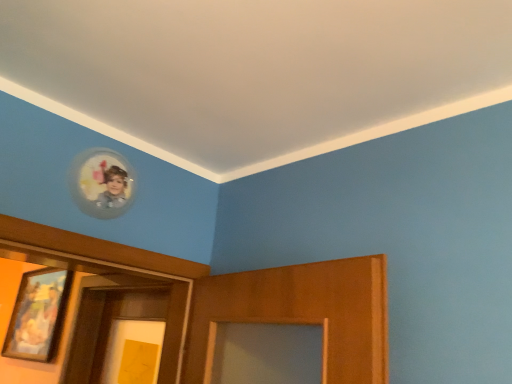
The height and width of the screenshot is (384, 512). What do you see at coordinates (38, 315) in the screenshot?
I see `wooden framed painting at left, positioned as the first picture frame in bottom-to-top order` at bounding box center [38, 315].

Where is `wooden framed painting at left, which is the second picture frame from right to left`? Image resolution: width=512 pixels, height=384 pixels. wooden framed painting at left, which is the second picture frame from right to left is located at coordinates (38, 315).

In order to face wooden framed painting at left, positioned as the first picture frame in bottom-to-top order, should I rotate leftwards or rightwards?

Turn left approximately 26.932 degrees to face it.

What is the approximate height of wooden framed painting at left, positioned as the first picture frame in bottom-to-top order?

The height of wooden framed painting at left, positioned as the first picture frame in bottom-to-top order, is 59.29 centimeters.

This screenshot has width=512, height=384. Describe the element at coordinates (102, 183) in the screenshot. I see `clear glass portrait at upper left, which is the first picture frame in top-to-bottom order` at that location.

Where is `clear glass portrait at upper left, positioned as the first picture frame in front-to-back order`? clear glass portrait at upper left, positioned as the first picture frame in front-to-back order is located at coordinates (102, 183).

Locate an element on the screen. This screenshot has width=512, height=384. wooden framed painting at left, the first picture frame from the left is located at coordinates (38, 315).

Can you confirm if clear glass portrait at upper left, positioned as the first picture frame in front-to-back order, is positioned to the right of wooden framed painting at left, which is counted as the second picture frame, starting from the top?

Correct, you'll find clear glass portrait at upper left, positioned as the first picture frame in front-to-back order, to the right of wooden framed painting at left, which is counted as the second picture frame, starting from the top.

Which is behind, clear glass portrait at upper left, which ranks as the 2th picture frame in back-to-front order, or wooden framed painting at left, which is the second picture frame from right to left?

wooden framed painting at left, which is the second picture frame from right to left, is more distant.

Is point (91, 214) closer or farther from the camera than point (36, 285)?

Clearly, point (91, 214) is closer to the camera than point (36, 285).

From the image's perspective, which is below, clear glass portrait at upper left, which ranks as the 2th picture frame in back-to-front order, or wooden framed painting at left, the first picture frame from the left?

From the image's view, wooden framed painting at left, the first picture frame from the left, is below.

From a real-world perspective, is clear glass portrait at upper left, the 2th picture frame when ordered from left to right, located higher than wooden framed painting at left, which is counted as the second picture frame, starting from the top?

Correct, in the physical world, clear glass portrait at upper left, the 2th picture frame when ordered from left to right, is higher than wooden framed painting at left, which is counted as the second picture frame, starting from the top.

Consider the image. Considering the sizes of clear glass portrait at upper left, the 2th picture frame when ordered from left to right, and wooden framed painting at left, which is counted as the second picture frame, starting from the top, in the image, is clear glass portrait at upper left, the 2th picture frame when ordered from left to right, wider or thinner than wooden framed painting at left, which is counted as the second picture frame, starting from the top,?

Considering their sizes, clear glass portrait at upper left, the 2th picture frame when ordered from left to right, looks slimmer than wooden framed painting at left, which is counted as the second picture frame, starting from the top.

From their relative heights in the image, would you say clear glass portrait at upper left, the 2th picture frame from the bottom, is taller or shorter than wooden framed painting at left, placed as the second picture frame when sorted from front to back?

clear glass portrait at upper left, the 2th picture frame from the bottom, is shorter than wooden framed painting at left, placed as the second picture frame when sorted from front to back.

Considering the sizes of objects clear glass portrait at upper left, the first picture frame in the right-to-left sequence, and wooden framed painting at left, which is counted as the second picture frame, starting from the top, in the image provided, who is bigger, clear glass portrait at upper left, the first picture frame in the right-to-left sequence, or wooden framed painting at left, which is counted as the second picture frame, starting from the top,?

wooden framed painting at left, which is counted as the second picture frame, starting from the top.

Is clear glass portrait at upper left, the 2th picture frame when ordered from left to right, situated inside wooden framed painting at left, placed as the second picture frame when sorted from front to back, or outside?

clear glass portrait at upper left, the 2th picture frame when ordered from left to right, is located beyond the bounds of wooden framed painting at left, placed as the second picture frame when sorted from front to back.

Is clear glass portrait at upper left, which is the first picture frame in top-to-bottom order, not near wooden framed painting at left, which is counted as the second picture frame, starting from the top?

Yes, clear glass portrait at upper left, which is the first picture frame in top-to-bottom order, and wooden framed painting at left, which is counted as the second picture frame, starting from the top, are quite far apart.

Is clear glass portrait at upper left, the first picture frame in the right-to-left sequence, facing towards wooden framed painting at left, which is counted as the second picture frame, starting from the top?

No.

This screenshot has width=512, height=384. What are the coordinates of `picture frame behind the clear glass portrait at upper left, which is the first picture frame in top-to-bottom order` in the screenshot? It's located at (38, 315).

Based on their positions, is wooden framed painting at left, acting as the 1th picture frame starting from the back, located to the left or right of clear glass portrait at upper left, the first picture frame in the right-to-left sequence?

wooden framed painting at left, acting as the 1th picture frame starting from the back, is positioned on clear glass portrait at upper left, the first picture frame in the right-to-left sequence,'s left side.

Is wooden framed painting at left, the first picture frame from the left, closer to the viewer compared to clear glass portrait at upper left, the 2th picture frame from the bottom?

No, wooden framed painting at left, the first picture frame from the left, is behind clear glass portrait at upper left, the 2th picture frame from the bottom.

Is point (68, 292) farther from viewer compared to point (100, 205)?

Yes, point (68, 292) is behind point (100, 205).

From the image's perspective, is wooden framed painting at left, placed as the second picture frame when sorted from front to back, over clear glass portrait at upper left, the first picture frame in the right-to-left sequence?

No, from the image's perspective, wooden framed painting at left, placed as the second picture frame when sorted from front to back, is not above clear glass portrait at upper left, the first picture frame in the right-to-left sequence.

From a real-world perspective, is wooden framed painting at left, positioned as the first picture frame in bottom-to-top order, positioned over clear glass portrait at upper left, the 2th picture frame when ordered from left to right, based on gravity?

Actually, wooden framed painting at left, positioned as the first picture frame in bottom-to-top order, is physically below clear glass portrait at upper left, the 2th picture frame when ordered from left to right, in the real world.

In the scene shown: Which object is thinner, wooden framed painting at left, which is the second picture frame from right to left, or clear glass portrait at upper left, which ranks as the 2th picture frame in back-to-front order?

clear glass portrait at upper left, which ranks as the 2th picture frame in back-to-front order.

In terms of height, does wooden framed painting at left, positioned as the first picture frame in bottom-to-top order, look taller or shorter compared to clear glass portrait at upper left, positioned as the first picture frame in front-to-back order?

Clearly, wooden framed painting at left, positioned as the first picture frame in bottom-to-top order, is taller compared to clear glass portrait at upper left, positioned as the first picture frame in front-to-back order.

Who is smaller, wooden framed painting at left, which is the second picture frame from right to left, or clear glass portrait at upper left, the 2th picture frame from the bottom?

With smaller size is clear glass portrait at upper left, the 2th picture frame from the bottom.

Is wooden framed painting at left, placed as the second picture frame when sorted from front to back, positioned beyond the bounds of clear glass portrait at upper left, the first picture frame in the right-to-left sequence?

Yes, wooden framed painting at left, placed as the second picture frame when sorted from front to back, is outside of clear glass portrait at upper left, the first picture frame in the right-to-left sequence.

Is wooden framed painting at left, positioned as the first picture frame in bottom-to-top order, far from clear glass portrait at upper left, which ranks as the 2th picture frame in back-to-front order?

Yes, wooden framed painting at left, positioned as the first picture frame in bottom-to-top order, is far from clear glass portrait at upper left, which ranks as the 2th picture frame in back-to-front order.

Is wooden framed painting at left, which is the second picture frame from right to left, aimed at clear glass portrait at upper left, the 2th picture frame when ordered from left to right?

No, wooden framed painting at left, which is the second picture frame from right to left, is not aimed at clear glass portrait at upper left, the 2th picture frame when ordered from left to right.

What's the angular difference between wooden framed painting at left, placed as the second picture frame when sorted from front to back, and clear glass portrait at upper left, the 2th picture frame from the bottom,'s facing directions?

The angle between the facing direction of wooden framed painting at left, placed as the second picture frame when sorted from front to back, and the facing direction of clear glass portrait at upper left, the 2th picture frame from the bottom, is 91.3 degrees.

The image size is (512, 384). I want to click on picture frame above the wooden framed painting at left, acting as the 1th picture frame starting from the back (from the image's perspective), so click(102, 183).

Identify the location of picture frame below the clear glass portrait at upper left, the 2th picture frame from the bottom (from a real-world perspective). (38, 315).

In the image, there is a wooden framed painting at left, the first picture frame from the left. Identify the location of picture frame above it (from the image's perspective). The height and width of the screenshot is (384, 512). point(102,183).